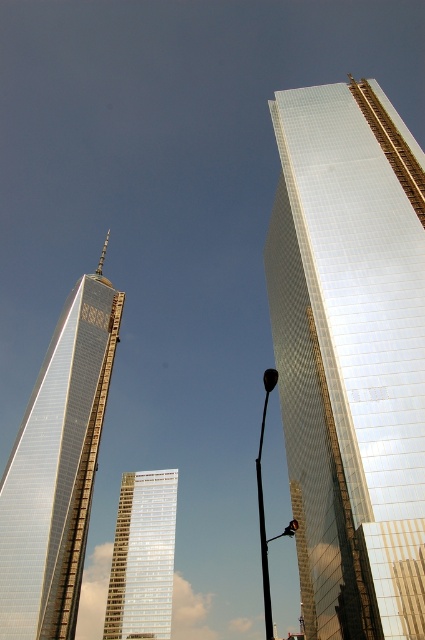
Does shiny glass skyscraper at right lie in front of shiny glass skyscraper at left?

Yes, it is in front of shiny glass skyscraper at left.

Image resolution: width=425 pixels, height=640 pixels. What are the coordinates of `shiny glass skyscraper at right` in the screenshot? It's located at (351, 355).

Is shiny glass skyscraper at right thinner than silver reflective glass building at center?

No, shiny glass skyscraper at right is not thinner than silver reflective glass building at center.

Is shiny glass skyscraper at right positioned before silver reflective glass building at center?

Yes.

Which is in front, point (408, 520) or point (119, 497)?

Point (408, 520) is more forward.

You are a GUI agent. You are given a task and a screenshot of the screen. Output one action in this format:
    pyautogui.click(x=<x>, y=<y>)
    Task: Click on the shiny glass skyscraper at right
    
    Given the screenshot: What is the action you would take?
    pyautogui.click(x=351, y=355)

Who is lower down, shiny glass skyscraper at left or silver reflective glass building at center?

Positioned lower is silver reflective glass building at center.

What do you see at coordinates (56, 467) in the screenshot? This screenshot has width=425, height=640. I see `shiny glass skyscraper at left` at bounding box center [56, 467].

Find the location of `shiny glass skyscraper at left`. shiny glass skyscraper at left is located at coordinates (56, 467).